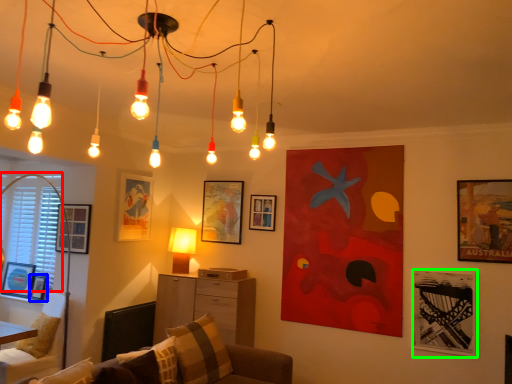
Question: Which object is positioned closest to window screen (highlighted by a red box)? Select from picture frame (highlighted by a blue box) and picture frame (highlighted by a green box).

Choices:
 (A) picture frame
 (B) picture frame

Answer: (A)